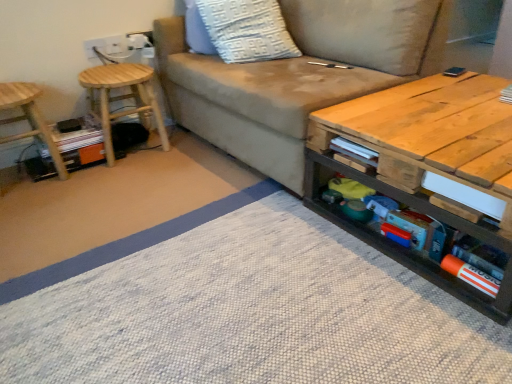
The width and height of the screenshot is (512, 384). What do you see at coordinates (247, 30) in the screenshot? I see `white textured pillow at upper center` at bounding box center [247, 30].

Measure the distance between natural wood stool at left, the 1th stool in the right-to-left sequence, and camera.

1.96 meters.

Identify the location of natural wood coffee table at center. (424, 163).

The width and height of the screenshot is (512, 384). Describe the element at coordinates (298, 75) in the screenshot. I see `suede beige couch at center` at that location.

This screenshot has height=384, width=512. In order to click on wooden book at lower right, marked as the 2th book in a front-to-back arrangement in this screenshot , I will do `click(354, 151)`.

Identify the location of orange matte book at lower right, which appears as the third book when viewed from the back. The height and width of the screenshot is (384, 512). (471, 275).

Consider the image. Does wooden book at lower right, positioned as the second book in bottom-to-top order, come behind suede beige couch at center?

Yes.

The width and height of the screenshot is (512, 384). I want to click on studio couch positioned vertically above the wooden book at lower right, positioned as the second book in bottom-to-top order (from a real-world perspective), so coord(298,75).

Does point (338, 149) appear closer or farther from the camera than point (207, 91)?

Point (338, 149) is positioned closer to the camera compared to point (207, 91).

Which is in front, suede beige couch at center or wooden stool at left, placed as the 2th stool when sorted from right to left?

suede beige couch at center.

From a real-world perspective, which object rests below the other?

In real-world perspective, wooden stool at left, placed as the 2th stool when sorted from right to left, is lower.

Which of these two, suede beige couch at center or wooden stool at left, positioned as the first stool in left-to-right order, stands taller?

suede beige couch at center.

From the image's perspective, is suede beige couch at center located above or below wooden stool at left, placed as the 2th stool when sorted from right to left?

Clearly, from the image's perspective, suede beige couch at center is above wooden stool at left, placed as the 2th stool when sorted from right to left.

Considering the positions of objects white textured pillow at upper center and wooden stool at left, positioned as the first stool in left-to-right order, in the image provided, who is more to the left, white textured pillow at upper center or wooden stool at left, positioned as the first stool in left-to-right order,?

Positioned to the left is wooden stool at left, positioned as the first stool in left-to-right order.

Are white textured pillow at upper center and wooden stool at left, placed as the 2th stool when sorted from right to left, far apart?

No, white textured pillow at upper center is in close proximity to wooden stool at left, placed as the 2th stool when sorted from right to left.

What's the angular difference between white textured pillow at upper center and wooden stool at left, placed as the 2th stool when sorted from right to left,'s facing directions?

white textured pillow at upper center and wooden stool at left, placed as the 2th stool when sorted from right to left, are facing 75 degrees away from each other.

Is wooden stool at left, placed as the 2th stool when sorted from right to left, a part of white textured pillow at upper center?

Actually, wooden stool at left, placed as the 2th stool when sorted from right to left, is outside white textured pillow at upper center.

Which object is further away from the camera taking this photo, natural wood coffee table at center or wooden stool at left, positioned as the first stool in left-to-right order?

wooden stool at left, positioned as the first stool in left-to-right order, is further from the camera.

Based on the photo, which object is positioned more to the right, natural wood coffee table at center or wooden stool at left, placed as the 2th stool when sorted from right to left?

From the viewer's perspective, natural wood coffee table at center appears more on the right side.

Consider the image. From a real-world perspective, who is located lower, natural wood coffee table at center or wooden stool at left, positioned as the first stool in left-to-right order?

wooden stool at left, positioned as the first stool in left-to-right order.

Is natural wood coffee table at center not inside wooden stool at left, positioned as the first stool in left-to-right order?

Indeed, natural wood coffee table at center is completely outside wooden stool at left, positioned as the first stool in left-to-right order.

From their relative heights in the image, would you say white textured pillow at upper center is taller or shorter than orange matte book at lower right, arranged as the first book when viewed from the front?

Clearly, white textured pillow at upper center is taller compared to orange matte book at lower right, arranged as the first book when viewed from the front.

Is white textured pillow at upper center looking in the opposite direction of orange matte book at lower right, positioned as the third book in top-to-bottom order?

No.

Is white textured pillow at upper center inside or outside of orange matte book at lower right, placed as the 1th book when sorted from bottom to top?

white textured pillow at upper center is located beyond the bounds of orange matte book at lower right, placed as the 1th book when sorted from bottom to top.

Which is in front, point (6, 140) or point (493, 287)?

Positioned in front is point (493, 287).

Is wooden stool at left, placed as the 2th stool when sorted from right to left, placed right next to orange matte book at lower right, positioned as the third book in top-to-bottom order?

No, wooden stool at left, placed as the 2th stool when sorted from right to left, is not with orange matte book at lower right, positioned as the third book in top-to-bottom order.

From the image's perspective, is wooden stool at left, positioned as the first stool in left-to-right order, on orange matte book at lower right, placed as the 1th book when sorted from bottom to top?

Yes, from the image's perspective, wooden stool at left, positioned as the first stool in left-to-right order, is over orange matte book at lower right, placed as the 1th book when sorted from bottom to top.

This screenshot has width=512, height=384. There is a orange matte book at lower right, the second book in the left-to-right sequence. Identify the location of the 1st stool above it (from the image's perspective). (29, 119).

Does orange matte book at lower right, which appears as the third book when viewed from the back, contain wooden stool at left, placed as the 2th stool when sorted from right to left?

No, orange matte book at lower right, which appears as the third book when viewed from the back, does not contain wooden stool at left, placed as the 2th stool when sorted from right to left.

How far apart are orange matte book at lower right, the second book in the left-to-right sequence, and wooden stool at left, positioned as the first stool in left-to-right order?

orange matte book at lower right, the second book in the left-to-right sequence, and wooden stool at left, positioned as the first stool in left-to-right order, are 1.75 meters apart from each other.

Is orange matte book at lower right, which appears as the second book when viewed from the right, looking in the opposite direction of wooden stool at left, positioned as the first stool in left-to-right order?

orange matte book at lower right, which appears as the second book when viewed from the right, is not turned away from wooden stool at left, positioned as the first stool in left-to-right order.

You are a GUI agent. You are given a task and a screenshot of the screen. Output one action in this format:
    pyautogui.click(x=<x>, y=<y>)
    Task: Click on the studio couch in front of the wooden book at lower right, positioned as the first book in left-to-right order
    
    Given the screenshot: What is the action you would take?
    pyautogui.click(x=298, y=75)

Where is `the 2nd stool to the left of the suede beige couch at center, starting your count from the anchor`? This screenshot has width=512, height=384. the 2nd stool to the left of the suede beige couch at center, starting your count from the anchor is located at coordinates click(29, 119).

Which object lies nearer to the anchor point natural wood coffee table at center, orange matte book at lower right, which appears as the third book when viewed from the back, or white paper book at right, the 3th book positioned from the bottom?

The object closer to natural wood coffee table at center is orange matte book at lower right, which appears as the third book when viewed from the back.

Considering their positions, is natural wood coffee table at center positioned further to white paper book at right, the 3th book positioned from the bottom, than suede beige couch at center?

suede beige couch at center is positioned further to the anchor white paper book at right, the 3th book positioned from the bottom.

Considering their positions, is orange matte book at lower right, which appears as the third book when viewed from the back, positioned further to natural wood stool at left, the 1th stool in the right-to-left sequence, than white paper book at right, marked as the 1th book in a right-to-left arrangement?

white paper book at right, marked as the 1th book in a right-to-left arrangement, is positioned further to the anchor natural wood stool at left, the 1th stool in the right-to-left sequence.

Estimate the real-world distances between objects in this image. Which object is closer to orange matte book at lower right, positioned as the third book in top-to-bottom order, white textured pillow at upper center or wooden stool at left, placed as the 2th stool when sorted from right to left?

white textured pillow at upper center.

Which object lies nearer to the anchor point wooden stool at left, placed as the 2th stool when sorted from right to left, natural wood stool at left, the 1th stool in the right-to-left sequence, or white paper book at right, the 3th book positioned from the bottom?

natural wood stool at left, the 1th stool in the right-to-left sequence, is positioned closer to the anchor wooden stool at left, placed as the 2th stool when sorted from right to left.

From the image, which object appears to be nearer to wooden book at lower right, positioned as the first book in left-to-right order, orange matte book at lower right, positioned as the third book in top-to-bottom order, or suede beige couch at center?

orange matte book at lower right, positioned as the third book in top-to-bottom order.

Considering their positions, is orange matte book at lower right, which appears as the second book when viewed from the right, positioned closer to white paper book at right, the 1th book from the top, than natural wood coffee table at center?

natural wood coffee table at center.

Which object lies further to the anchor point white textured pillow at upper center, natural wood coffee table at center or natural wood stool at left, the 1th stool in the right-to-left sequence?

natural wood coffee table at center is positioned further to the anchor white textured pillow at upper center.

The width and height of the screenshot is (512, 384). I want to click on throw pillow between natural wood stool at left, the 1th stool in the right-to-left sequence, and natural wood coffee table at center from left to right, so click(247, 30).

Where is `throw pillow between natural wood stool at left, the 1th stool in the right-to-left sequence, and suede beige couch at center, in the horizontal direction`? The image size is (512, 384). throw pillow between natural wood stool at left, the 1th stool in the right-to-left sequence, and suede beige couch at center, in the horizontal direction is located at coordinates (247, 30).

Where is `table between wooden book at lower right, which is the second book in top-to-bottom order, and white paper book at right, which is counted as the 3th book, starting from the front, from left to right`? This screenshot has height=384, width=512. table between wooden book at lower right, which is the second book in top-to-bottom order, and white paper book at right, which is counted as the 3th book, starting from the front, from left to right is located at coordinates (424, 163).

Locate an element on the screen. studio couch between wooden stool at left, placed as the 2th stool when sorted from right to left, and orange matte book at lower right, which appears as the third book when viewed from the back, from left to right is located at coordinates (298, 75).